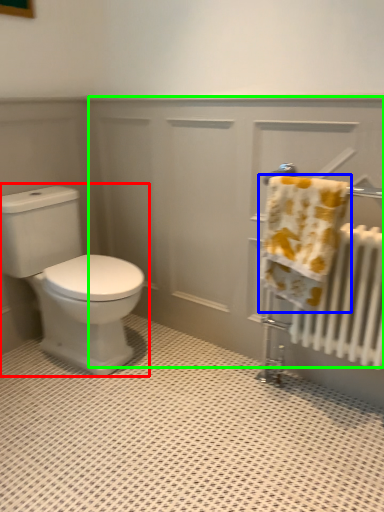
Question: Which object is positioned farthest from toilet (highlighted by a red box)? Select from towel (highlighted by a blue box) and screen door (highlighted by a green box).

Choices:
 (A) towel
 (B) screen door

Answer: (A)